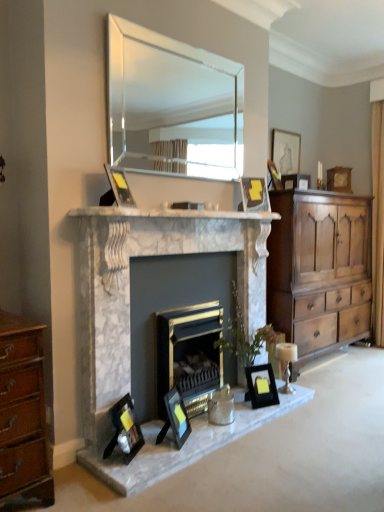
Question: From the image's perspective, relative to matte black picture frame at upper center, the sixth picture frame viewed from the left, is wooden picture frame at upper right, which ranks as the second picture frame in top-to-bottom order, above or below?

Choices:
 (A) above
 (B) below

Answer: (A)

Question: From their relative heights in the image, would you say wooden picture frame at upper right, acting as the 1th picture frame starting from the back, is taller or shorter than matte black picture frame at upper center, the sixth picture frame viewed from the left?

Choices:
 (A) tall
 (B) short

Answer: (A)

Question: Estimate the real-world distances between objects in this image. Which object is farther from the marble fireplace at center, the 2th fireplace when ordered from right to left?

Choices:
 (A) black matte picture frame at lower center, marked as the fifth picture frame in a back-to-front arrangement
 (B) silver metallic candle holder at center
 (C) matte black picture frame at lower left, acting as the second picture frame starting from the left
 (D) matte black picture frame at upper center, arranged as the third picture frame when viewed from the top
 (E) wooden chest of drawers at right

Answer: (D)

Question: Which is nearer to the matte black picture frame at upper center, arranged as the 6th picture frame when viewed from the front?

Choices:
 (A) white marble fireplace at center
 (B) matte black picture frame at upper center, which ranks as the fifth picture frame in right-to-left order
 (C) silver metallic candle holder at center
 (D) wooden picture frame at upper right, which ranks as the second picture frame in top-to-bottom order
 (E) matte black picture frame at center, marked as the 3th picture frame in a left-to-right arrangement

Answer: (D)